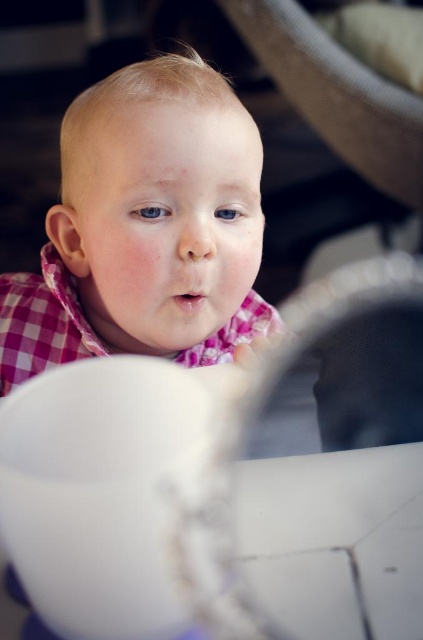
Question: Is pink checkered bib at center above white matte bowl at lower center?

Choices:
 (A) yes
 (B) no

Answer: (A)

Question: Can you confirm if pink checkered bib at center is smaller than white matte bowl at lower center?

Choices:
 (A) no
 (B) yes

Answer: (A)

Question: In this image, where is pink checkered bib at center located relative to white matte bowl at lower center?

Choices:
 (A) right
 (B) left

Answer: (B)